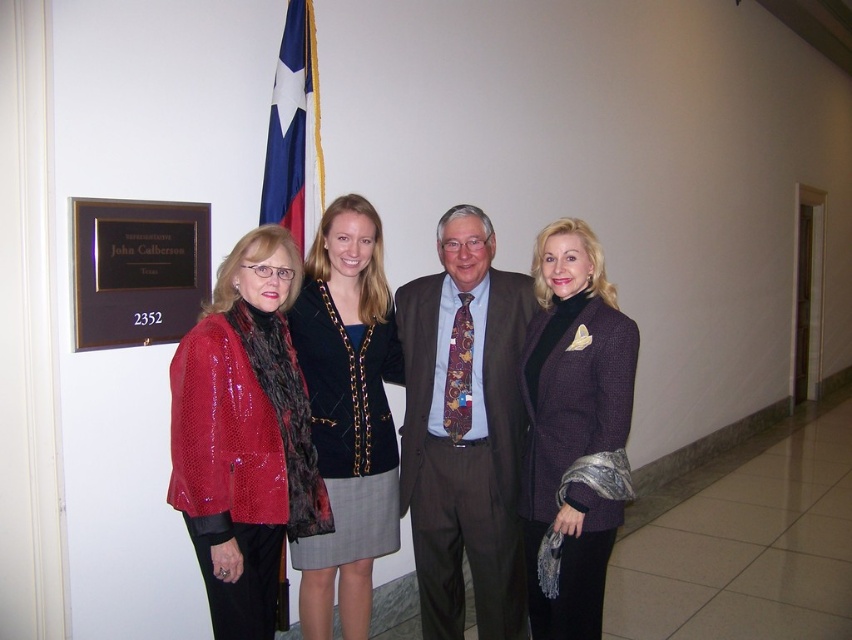
What are the coordinates of the shiny red sequined jacket at left?

The shiny red sequined jacket at left is located at coordinates point (245, 435).

You are a photographer setting up for a group photo. You need to ensure that all participants are visible within the frame. Given the brown textured suit at center and the velvet black blazer at center, which participant might require more space to accommodate their attire?

The brown textured suit at center might require more space as it is wider than the velvet black blazer at center.